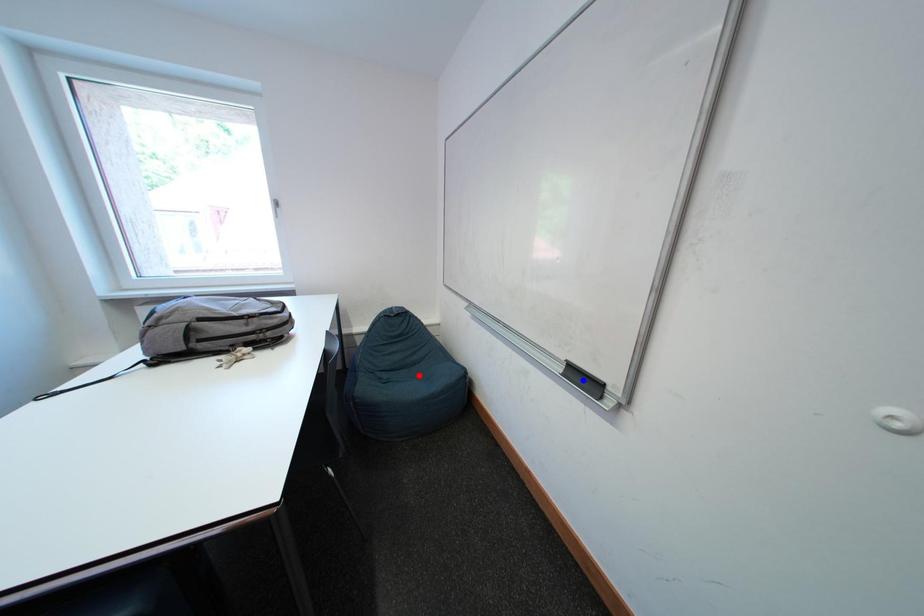
Question: Two points are marked on the image. Which point is closer to the camera?

Choices:
 (A) Blue point is closer.
 (B) Red point is closer.

Answer: (A)